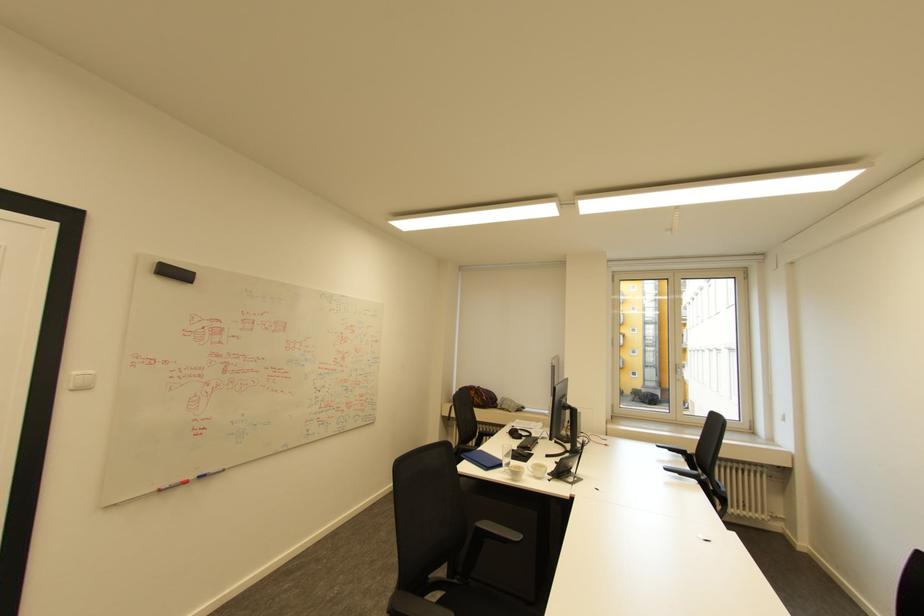
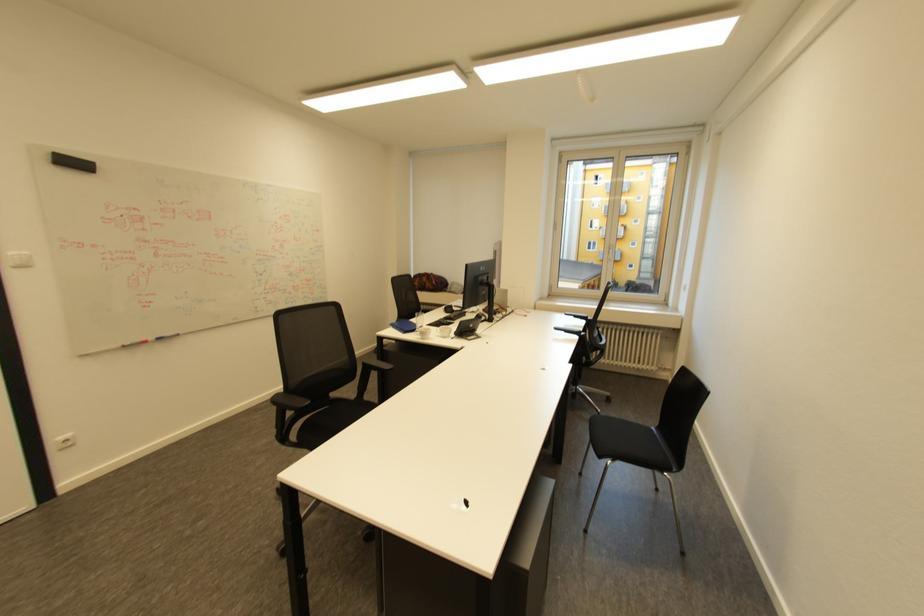
In the second image, find the point that corresponds to the point at 507,426 in the first image.

(448, 305)